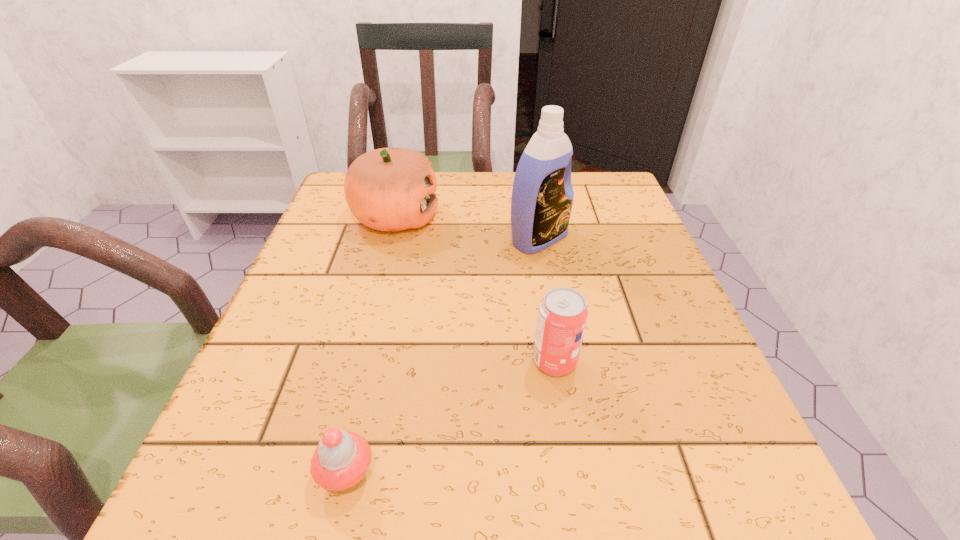
The height and width of the screenshot is (540, 960). Identify the location of free space at the right edge of the desktop. (646, 393).

What are the coordinates of `vacant space at the far left corner` in the screenshot? It's located at (336, 185).

Find the location of `free space at the near left corner of the desktop`. free space at the near left corner of the desktop is located at coordinates (260, 461).

Locate an element on the screen. This screenshot has width=960, height=540. free location at the far right corner of the desktop is located at coordinates (634, 209).

In order to click on vacant area that lies between the pumpkin and the tallest object in this screenshot , I will do `click(468, 228)`.

The image size is (960, 540). Identify the location of unoccupied area between the second tallest object and the cupcake. (372, 346).

The width and height of the screenshot is (960, 540). What are the coordinates of `free space between the shortest object and the detergent` in the screenshot? It's located at (443, 356).

You are a GUI agent. You are given a task and a screenshot of the screen. Output one action in this format:
    pyautogui.click(x=<x>, y=<y>)
    Task: Click on the vacant space in between the cupcake and the second nearest object
    
    Given the screenshot: What is the action you would take?
    pyautogui.click(x=451, y=418)

Where is `free space between the nearest object and the detergent`? free space between the nearest object and the detergent is located at coordinates (443, 356).

Find the location of a particular element. This screenshot has height=540, width=960. empty space that is in between the second shortest object and the pumpkin is located at coordinates (475, 289).